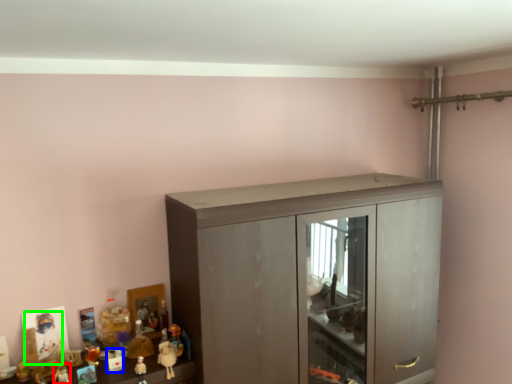
Question: Which is nearer to the toy (highlighted by a red box)? toy (highlighted by a blue box) or toy (highlighted by a green box).

Choices:
 (A) toy
 (B) toy

Answer: (B)